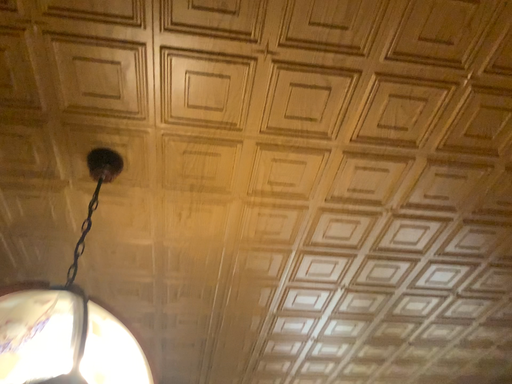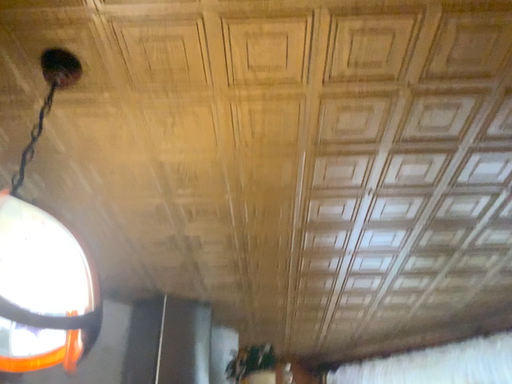
Question: How did the camera likely rotate when shooting the video?

Choices:
 (A) rotated downward
 (B) rotated upward

Answer: (A)